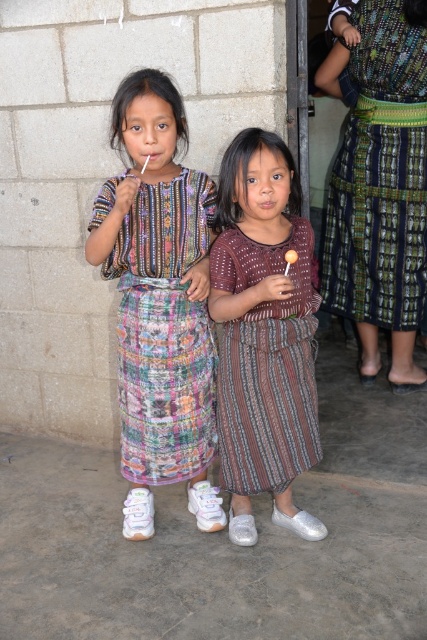
What do you see at coordinates (164, 332) in the screenshot? I see `multicolored woven dress at center` at bounding box center [164, 332].

Between point (207, 400) and point (242, 278), which one is positioned in front?

Positioned in front is point (242, 278).

The width and height of the screenshot is (427, 640). I want to click on multicolored woven dress at center, so click(164, 332).

Where is `multicolored woven dress at center`? The width and height of the screenshot is (427, 640). multicolored woven dress at center is located at coordinates (164, 332).

Is point (401, 284) positioned behind point (152, 189)?

That is True.

Which is behind, point (415, 195) or point (208, 332)?

The point (415, 195) is behind.

The width and height of the screenshot is (427, 640). What are the coordinates of `green and blue woven skirt at right` in the screenshot? It's located at click(x=380, y=176).

Measure the distance from green and blue woven skirt at right to brown striped dress at center.

The distance of green and blue woven skirt at right from brown striped dress at center is 3.69 feet.

Is point (327, 198) positioned behind point (277, 406)?

Yes, point (327, 198) is farther from viewer.

Does point (347, 291) come behind point (251, 323)?

Yes, point (347, 291) is behind point (251, 323).

This screenshot has height=640, width=427. Find the location of `green and blue woven skirt at right`. green and blue woven skirt at right is located at coordinates (380, 176).